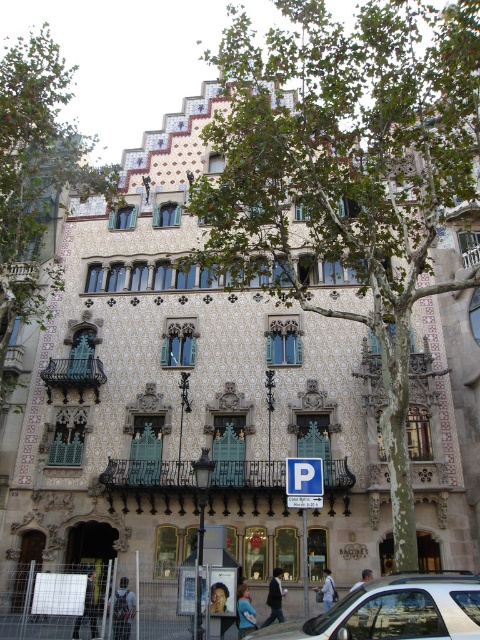
Question: Which point is closer to the camera?

Choices:
 (A) blue denim jacket at lower center
 (B) dark gray fabric backpack at lower left
 (C) green leafy tree at upper left
 (D) green leafy tree at center

Answer: (D)

Question: Which point is farther to the camera?

Choices:
 (A) green leafy tree at upper left
 (B) green leafy tree at center

Answer: (A)

Question: Is blue plastic parking sign at center above light blue denim jacket at lower left?

Choices:
 (A) no
 (B) yes

Answer: (B)

Question: In this image, where is blue plastic parking sign at center located relative to dark gray fabric backpack at lower left?

Choices:
 (A) above
 (B) below

Answer: (A)

Question: Which object is the farthest from the light blue denim jacket at lower left?

Choices:
 (A) blue plastic parking sign at center
 (B) blue denim jacket at lower center
 (C) white glossy car at lower center

Answer: (C)

Question: Can you confirm if green leafy tree at upper left is positioned below light blue denim jacket at center?

Choices:
 (A) no
 (B) yes

Answer: (A)